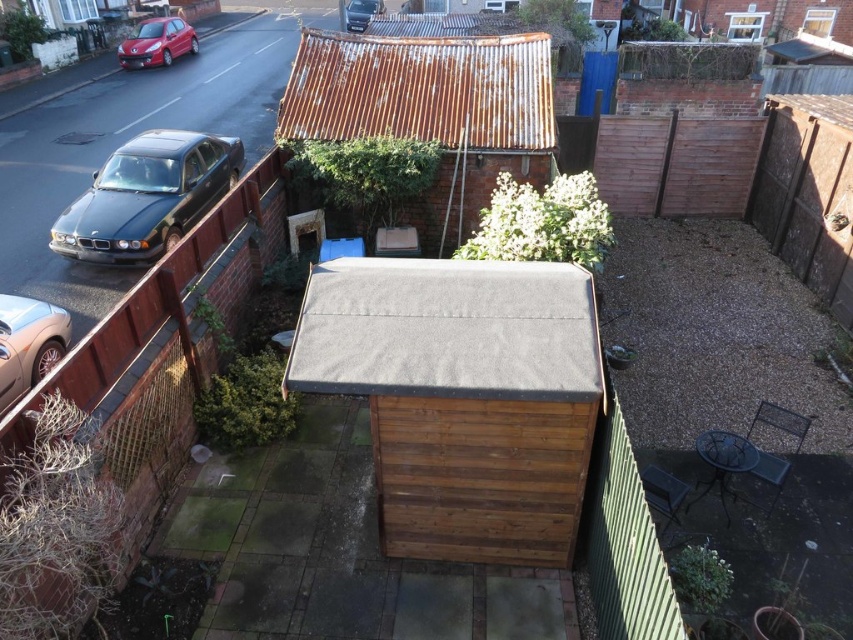
Question: Estimate the real-world distances between objects in this image. Which object is closer to the brown wooden shed at center?

Choices:
 (A) matte black car at left
 (B) metallic silver car at upper left
 (C) metallic gold car at left

Answer: (C)

Question: Can you confirm if matte black car at left is positioned to the right of metallic silver car at upper left?

Choices:
 (A) yes
 (B) no

Answer: (B)

Question: Observing the image, what is the correct spatial positioning of metallic gold car at left in reference to shiny red car at upper left?

Choices:
 (A) above
 (B) below

Answer: (B)

Question: Estimate the real-world distances between objects in this image. Which object is closer to the brown wooden shed at center?

Choices:
 (A) metallic gold car at left
 (B) matte black car at left
 (C) metallic silver car at upper left
 (D) shiny red car at upper left

Answer: (A)

Question: Among these points, which one is nearest to the camera?

Choices:
 (A) (192, 29)
 (B) (364, 1)
 (C) (403, 333)

Answer: (C)

Question: Where is brown wooden shed at center located in relation to metallic silver car at upper left in the image?

Choices:
 (A) above
 (B) below

Answer: (B)